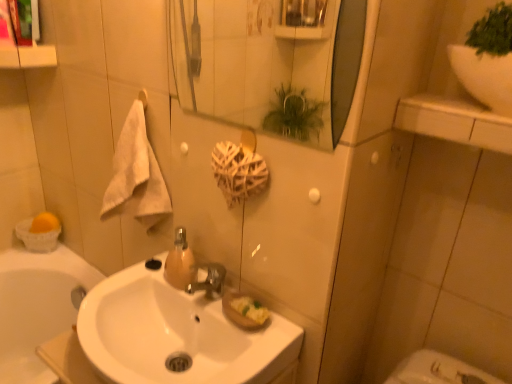
Question: Is there a large distance between white glossy sink at upper right and white glossy sink at center?

Choices:
 (A) no
 (B) yes

Answer: (A)

Question: Could white glossy sink at center be considered to be inside white glossy sink at upper right?

Choices:
 (A) yes
 (B) no

Answer: (B)

Question: Does white glossy sink at upper right have a lesser width compared to white glossy sink at center?

Choices:
 (A) no
 (B) yes

Answer: (B)

Question: Are white glossy sink at upper right and white glossy sink at center beside each other?

Choices:
 (A) yes
 (B) no

Answer: (B)

Question: From a real-world perspective, is white glossy sink at upper right positioned over white glossy sink at center based on gravity?

Choices:
 (A) yes
 (B) no

Answer: (A)

Question: From the image's perspective, is glossy glass mirror at upper center above or below white fluffy towel at left?

Choices:
 (A) below
 (B) above

Answer: (B)

Question: In terms of height, does glossy glass mirror at upper center look taller or shorter compared to white fluffy towel at left?

Choices:
 (A) tall
 (B) short

Answer: (B)

Question: Which is correct: glossy glass mirror at upper center is inside white fluffy towel at left, or outside of it?

Choices:
 (A) outside
 (B) inside

Answer: (A)

Question: Is point (318, 3) closer or farther from the camera than point (114, 198)?

Choices:
 (A) farther
 (B) closer

Answer: (A)

Question: From a real-world perspective, is white fluffy towel at left physically located above or below white glossy sink at center?

Choices:
 (A) above
 (B) below

Answer: (A)

Question: In terms of height, does white fluffy towel at left look taller or shorter compared to white glossy sink at center?

Choices:
 (A) tall
 (B) short

Answer: (A)

Question: Does point (142, 122) appear closer or farther from the camera than point (245, 355)?

Choices:
 (A) closer
 (B) farther

Answer: (B)

Question: From the image's perspective, is white fluffy towel at left above or below white glossy sink at center?

Choices:
 (A) above
 (B) below

Answer: (A)

Question: From a real-world perspective, is white glossy sink at upper right above or below translucent amber glass soap dispenser at center?

Choices:
 (A) above
 (B) below

Answer: (A)

Question: Considering the positions of white glossy sink at upper right and translucent amber glass soap dispenser at center in the image, is white glossy sink at upper right wider or thinner than translucent amber glass soap dispenser at center?

Choices:
 (A) wide
 (B) thin

Answer: (A)